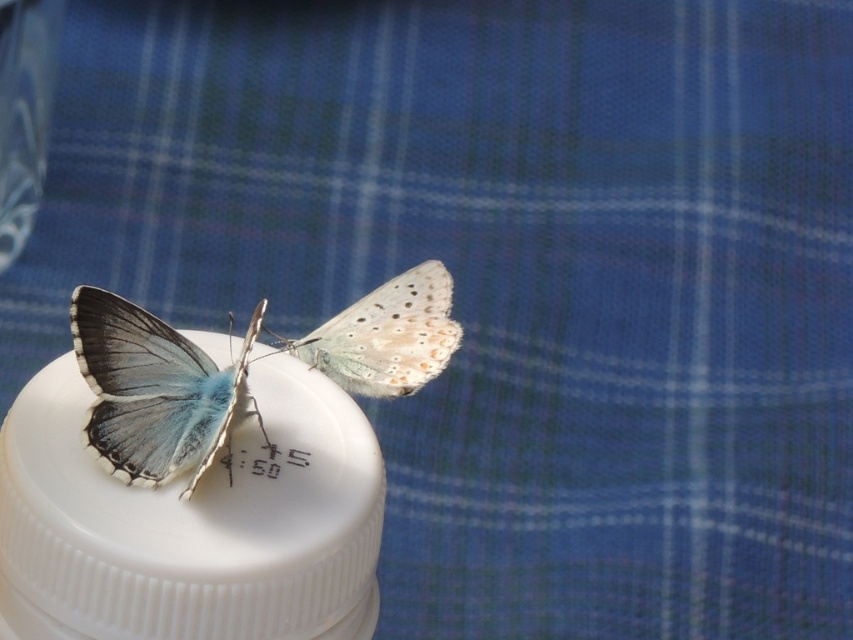
You are an entomologist observing two butterflies on a container cap. The butterflies are the matte blue butterfly at center and the translucent white butterfly at center. Which butterfly has a smaller width?

The matte blue butterfly at center has a lesser width compared to the translucent white butterfly at center, so the matte blue butterfly at center is smaller in width.

You are a photographer trying to capture the matte blue butterfly at center in the image. The camera is set to focus at point coordinates of 0.611, 0.182. Will the butterfly be in focus?

Yes, the matte blue butterfly at center is exactly at point coordinates of (154, 390), so it will be in focus.

You are a photographer trying to capture both the matte blue butterfly at center and the translucent white butterfly at center in a single frame. The camera you are using has a maximum focus range of 12 centimeters. Can you focus on both butterflies at the same time?

The distance between the matte blue butterfly at center and the translucent white butterfly at center is 13.19 centimeters, which exceeds the camera maximum focus range of 12 centimeters. Therefore, you cannot focus on both butterflies at the same time.